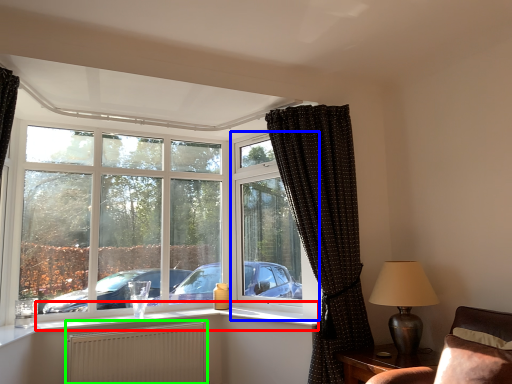
Question: Which object is positioned closest to window sill (highlighted by a red box)? Select from window frame (highlighted by a blue box) and radiator (highlighted by a green box).

Choices:
 (A) window frame
 (B) radiator

Answer: (B)